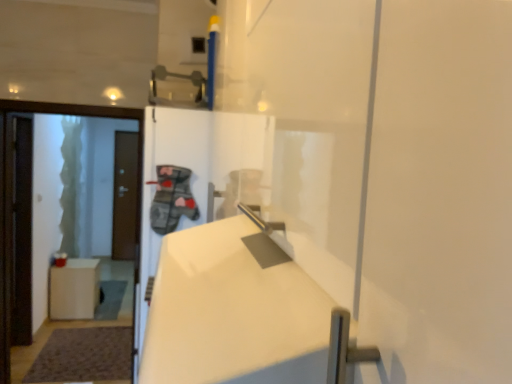
Question: From the image's perspective, is white matte trash can at lower left under white glossy door at left, the 1th door viewed from the front?

Choices:
 (A) no
 (B) yes

Answer: (B)

Question: Considering the relative sizes of white matte trash can at lower left and white glossy door at left, arranged as the second door when viewed from the left, in the image provided, is white matte trash can at lower left shorter than white glossy door at left, arranged as the second door when viewed from the left,?

Choices:
 (A) no
 (B) yes

Answer: (B)

Question: Does white matte trash can at lower left have a smaller size compared to white glossy door at left, the 1th door viewed from the front?

Choices:
 (A) yes
 (B) no

Answer: (A)

Question: Is white matte trash can at lower left beside white glossy door at left, the 2th door positioned from the back?

Choices:
 (A) yes
 (B) no

Answer: (B)

Question: Can you confirm if white matte trash can at lower left is thinner than white glossy door at left, marked as the first door in a right-to-left arrangement?

Choices:
 (A) yes
 (B) no

Answer: (B)

Question: From a real-world perspective, is brown matte door at left, which is the first door from back to front, above or below metallic gray door handle at upper center?

Choices:
 (A) above
 (B) below

Answer: (B)

Question: In the image, is brown matte door at left, the first door positioned from the left, on the left side or the right side of metallic gray door handle at upper center?

Choices:
 (A) right
 (B) left

Answer: (B)

Question: Considering the positions of point (128, 193) and point (204, 107), is point (128, 193) closer or farther from the camera than point (204, 107)?

Choices:
 (A) closer
 (B) farther

Answer: (B)

Question: Looking at the image, does brown matte door at left, which appears as the 2th door when viewed from the front, seem bigger or smaller compared to metallic gray door handle at upper center?

Choices:
 (A) small
 (B) big

Answer: (B)

Question: Is white glossy door at left, the 1th door viewed from the front, situated inside brown matte door at left, arranged as the 2th door when viewed from the right, or outside?

Choices:
 (A) inside
 (B) outside

Answer: (B)

Question: Is white glossy door at left, the 1th door viewed from the front, taller or shorter than brown matte door at left, the first door positioned from the left?

Choices:
 (A) short
 (B) tall

Answer: (A)

Question: Based on their positions, is white glossy door at left, the 1th door viewed from the front, located to the left or right of brown matte door at left, which is the first door from back to front?

Choices:
 (A) right
 (B) left

Answer: (A)

Question: Is point (37, 107) positioned closer to the camera than point (129, 173)?

Choices:
 (A) closer
 (B) farther

Answer: (A)

Question: Considering the positions of brown matte door at left, the first door positioned from the left, and white matte trash can at lower left in the image, is brown matte door at left, the first door positioned from the left, bigger or smaller than white matte trash can at lower left?

Choices:
 (A) big
 (B) small

Answer: (B)

Question: Is brown matte door at left, the first door positioned from the left, inside the boundaries of white matte trash can at lower left, or outside?

Choices:
 (A) inside
 (B) outside

Answer: (B)